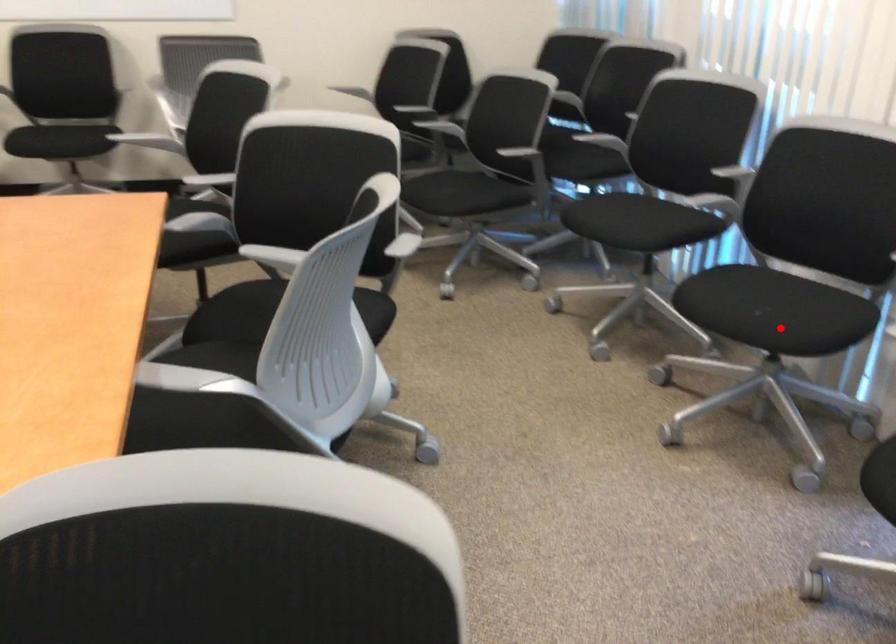
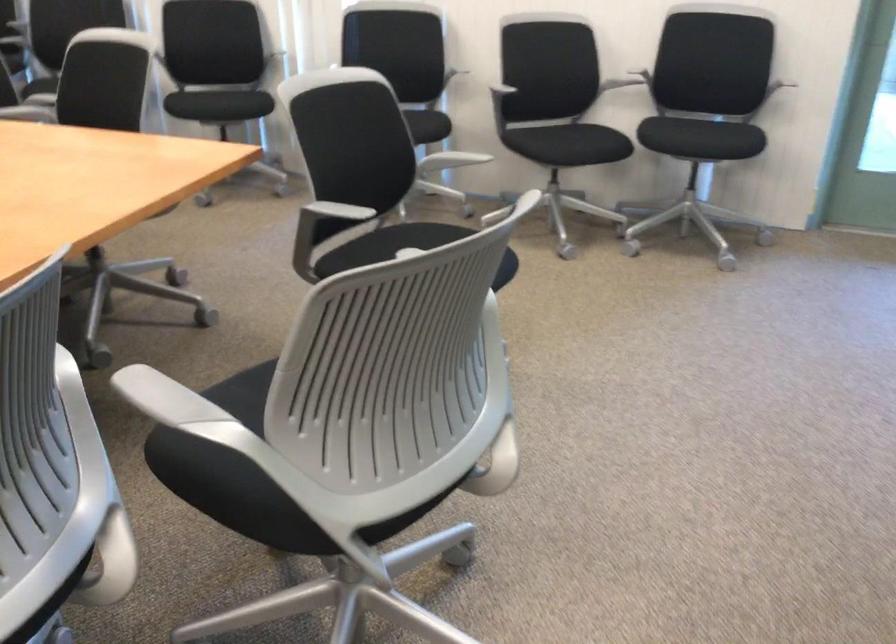
The point at the highlighted location is marked in the first image. Where is the corresponding point in the second image?

(238, 102)